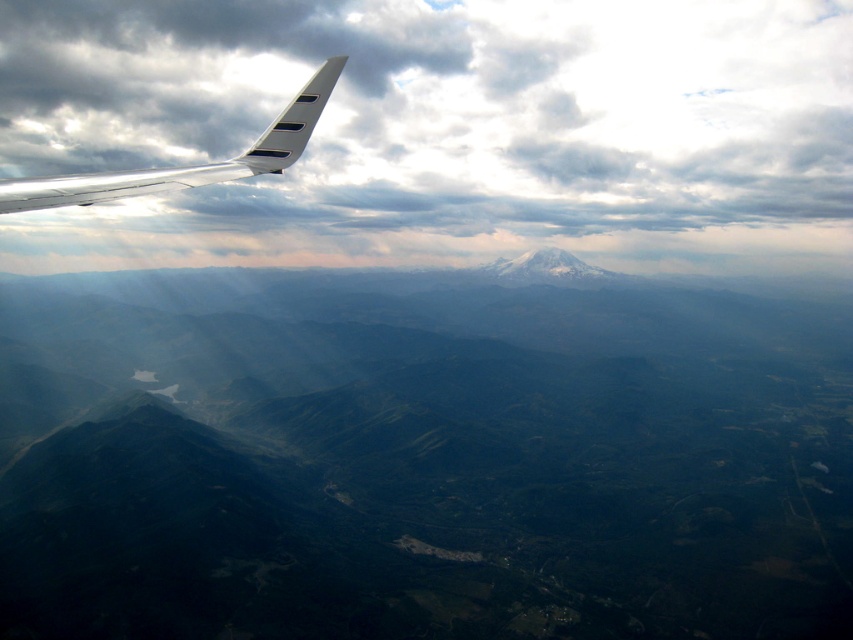
You are a passenger sitting by the window and want to take a photo of the green textured mountains at center through the transparent plastic airplane window at upper left. Will the mountains be visible through the window?

The green textured mountains at center are further to the viewer than the transparent plastic airplane window at upper left, so the mountains are closer to the window. This means the mountains would be visible through the transparent plastic airplane window at upper left as they are in front of it from your perspective.

You are a pilot flying at an altitude of 3,000 meters and want to drop a package to a specific location marked by the point at coordinates point (x=178, y=572). The package needs to land within a 100 meter radius of the target. Given that the point is 339.16 meters away from your current position, can you successfully drop the package within the required radius?

The point at coordinates point (x=178, y=572) is 339.16 meters away from the viewer. Since the required radius is 100 meters, the distance is greater than the allowable margin, so the package cannot be dropped successfully within the required radius.

As you look out from the airplane cabin, you notice the transparent plastic airplane window at upper left and the green textured mountains at center. Which object is positioned to the left of the other?

The green textured mountains at center are to the left of the transparent plastic airplane window at upper left.